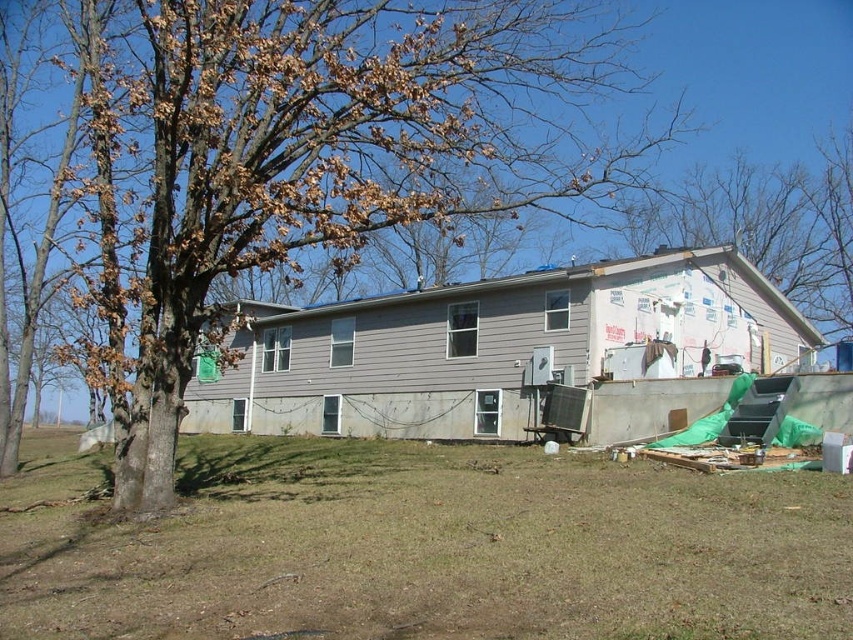
You are a construction worker standing at the front of the house. You need to place a heavy tool on the ground near the brown leafy tree at left. However, you must avoid placing it on the brown grass at lower center to prevent damage. Where should you place the tool instead?

Result: You should place the tool on the ground near the brown leafy tree at left but not on the brown grass at lower center. Since the brown grass at lower center is located below the brown leafy tree at left, placing the tool to the side or behind the tree would avoid the grass.

You are a construction worker who needs to place a new fence between the brown grass at lower center and the brown leafy tree at left. Which area should you prioritize for placing the fence first based on their sizes?

The brown grass at lower center has a smaller size compared to the brown leafy tree at left, so you should prioritize placing the fence near the brown leafy tree at left first since it covers a larger area.

Consider the image. You are a construction worker standing at the edge of the property. You need to move a heavy tool from the brown leafy tree at left to the brown grass at lower center. Which direction should you move it to place it correctly?

The brown grass at lower center is positioned on the right side of the brown leafy tree at left, so you should move the tool to the right to place it correctly.